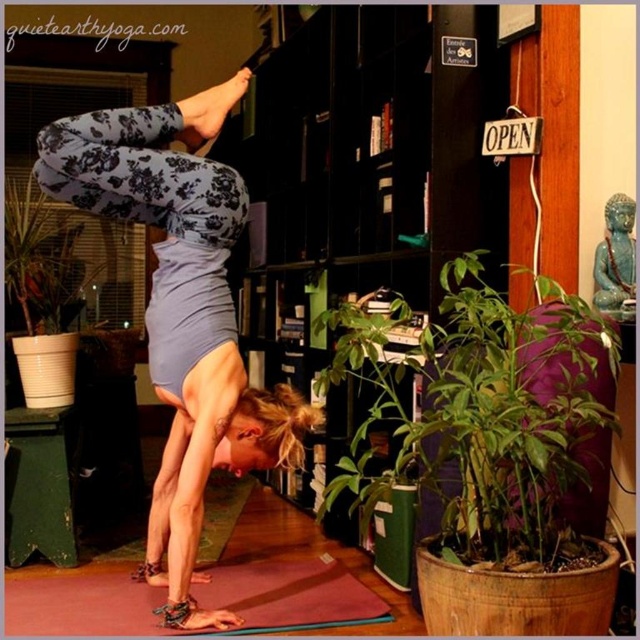
Consider the image. You are a yoga instructor preparing for a class. You have a rubber yoga mat at lower center and a green leafy plant at lower left. If you want to place the plant on the mat, will it fit based on their sizes?

The rubber yoga mat at lower center is wider than the green leafy plant at lower left, so the plant will fit on the mat.

You are a yoga instructor preparing the studio for class. You need to place a new yoga mat that is 2 meters long. The black wood bookshelf at center and the green leafy plant at lower right are in the way. Which object do you need to move to make space for the mat?

The black wood bookshelf at center is wider than the green leafy plant at lower right, so you should move the black wood bookshelf at center to make space for the 2 meter long yoga mat.

You are a yoga instructor setting up a classroom. You need to place a new yoga mat between the black wood bookshelf at center and the green leafy plant at lower right. Based on their positions, which side of the bookshelf should the mat be placed to ensure it is closer to the plant?

The black wood bookshelf at center is to the left of the green leafy plant at lower right, so placing the yoga mat to the right side of the black wood bookshelf at center will position it closer to the green leafy plant at lower right.